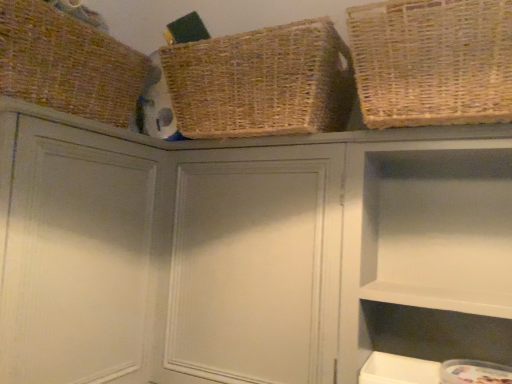
Question: Considering the relative sizes of woven natural basket at upper center, arranged as the 2th basket when viewed from the left, and brown woven basket at upper left, which appears as the first basket when viewed from the left, in the image provided, is woven natural basket at upper center, arranged as the 2th basket when viewed from the left, taller than brown woven basket at upper left, which appears as the first basket when viewed from the left,?

Choices:
 (A) no
 (B) yes

Answer: (B)

Question: Does woven natural basket at upper center, arranged as the 2th basket when viewed from the left, have a smaller size compared to brown woven basket at upper left, which appears as the first basket when viewed from the left?

Choices:
 (A) no
 (B) yes

Answer: (B)

Question: Is woven natural basket at upper center, the second basket positioned from the right, bigger than brown woven basket at upper left, which appears as the first basket when viewed from the left?

Choices:
 (A) no
 (B) yes

Answer: (A)

Question: Is brown woven basket at upper left, which appears as the first basket when viewed from the left, inside woven natural basket at upper center, the second basket positioned from the right?

Choices:
 (A) no
 (B) yes

Answer: (A)

Question: Is woven natural basket at upper center, arranged as the 2th basket when viewed from the left, touching brown woven basket at upper left, positioned as the third basket in right-to-left order?

Choices:
 (A) yes
 (B) no

Answer: (B)

Question: Considering the positions of brown woven basket at upper left, which appears as the first basket when viewed from the left, and woven natural basket at upper center, arranged as the 2th basket when viewed from the left, in the image, is brown woven basket at upper left, which appears as the first basket when viewed from the left, taller or shorter than woven natural basket at upper center, arranged as the 2th basket when viewed from the left,?

Choices:
 (A) tall
 (B) short

Answer: (B)

Question: From a real-world perspective, is brown woven basket at upper left, which appears as the first basket when viewed from the left, positioned above or below woven natural basket at upper center, the second basket positioned from the right?

Choices:
 (A) below
 (B) above

Answer: (B)

Question: Is brown woven basket at upper left, positioned as the third basket in right-to-left order, in front of or behind woven natural basket at upper center, the second basket positioned from the right, in the image?

Choices:
 (A) behind
 (B) front

Answer: (B)

Question: In terms of width, does brown woven basket at upper left, which appears as the first basket when viewed from the left, look wider or thinner when compared to woven natural basket at upper center, arranged as the 2th basket when viewed from the left?

Choices:
 (A) thin
 (B) wide

Answer: (B)

Question: Visually, is natural woven basket at upper right, which is the first basket in right-to-left order, positioned to the left or to the right of matte gray cabinet at center, positioned as the second cabinet in right-to-left order?

Choices:
 (A) left
 (B) right

Answer: (B)

Question: From the image's perspective, is natural woven basket at upper right, acting as the third basket starting from the left, above or below matte gray cabinet at center, the second cabinet in the left-to-right sequence?

Choices:
 (A) above
 (B) below

Answer: (A)

Question: From a real-world perspective, is natural woven basket at upper right, which is the first basket in right-to-left order, physically located above or below matte gray cabinet at center, the second cabinet in the left-to-right sequence?

Choices:
 (A) below
 (B) above

Answer: (B)

Question: Would you say natural woven basket at upper right, acting as the third basket starting from the left, is inside or outside matte gray cabinet at center, the second cabinet in the left-to-right sequence?

Choices:
 (A) outside
 (B) inside

Answer: (A)

Question: Considering the positions of natural woven basket at upper right, which is the first basket in right-to-left order, and brown woven basket at upper left, which appears as the first basket when viewed from the left, in the image, is natural woven basket at upper right, which is the first basket in right-to-left order, taller or shorter than brown woven basket at upper left, which appears as the first basket when viewed from the left,?

Choices:
 (A) short
 (B) tall

Answer: (A)

Question: Considering the relative positions of natural woven basket at upper right, which is the first basket in right-to-left order, and brown woven basket at upper left, positioned as the third basket in right-to-left order, in the image provided, is natural woven basket at upper right, which is the first basket in right-to-left order, to the left or to the right of brown woven basket at upper left, positioned as the third basket in right-to-left order,?

Choices:
 (A) left
 (B) right

Answer: (B)